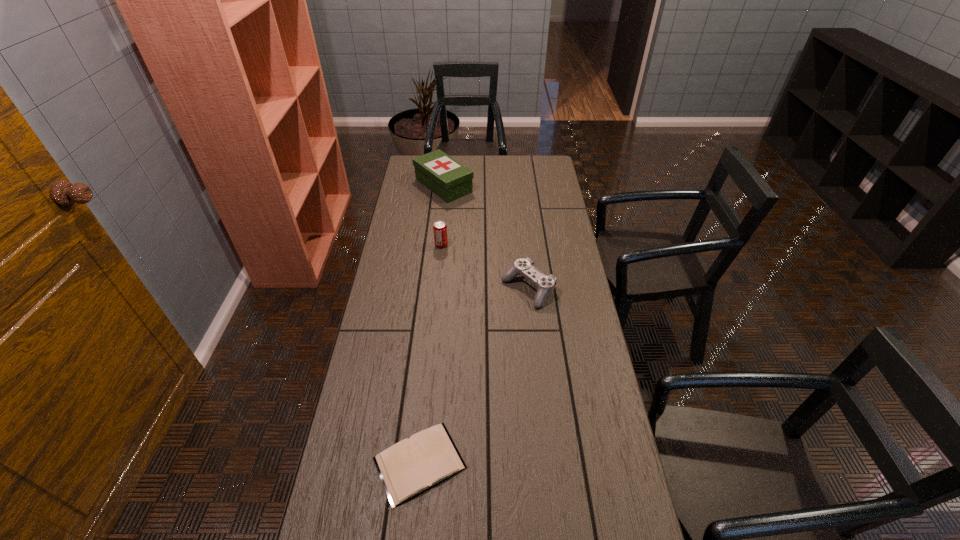
This screenshot has height=540, width=960. I want to click on the farthest object, so click(x=447, y=178).

Locate an element on the screen. The height and width of the screenshot is (540, 960). the third nearest object is located at coordinates (440, 229).

This screenshot has height=540, width=960. Find the location of `control`. control is located at coordinates (545, 284).

At what (x,y) coordinates should I click in order to perform the action: click on the rightmost object. Please return your answer as a coordinate pair (x, y). Looking at the image, I should click on (545, 284).

Find the location of a particular element. The height and width of the screenshot is (540, 960). hardback book is located at coordinates (411, 466).

Find the location of `the nearest object`. the nearest object is located at coordinates (411, 466).

Image resolution: width=960 pixels, height=540 pixels. In order to click on free space located on the front of the farthest object in this screenshot , I will do `click(436, 256)`.

Find the location of a particular element. The height and width of the screenshot is (540, 960). free space located 0.310m on the back of the third nearest object is located at coordinates (445, 199).

Find the location of a particular element. This screenshot has width=960, height=540. free region located on the back of the rightmost object is located at coordinates (525, 260).

Where is `blank space located 0.240m on the back of the hardback book`? blank space located 0.240m on the back of the hardback book is located at coordinates (430, 355).